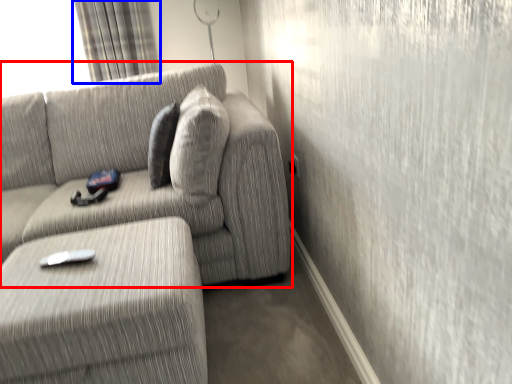
Question: Among these objects, which one is nearest to the camera, studio couch (highlighted by a red box) or curtain (highlighted by a blue box)?

Choices:
 (A) studio couch
 (B) curtain

Answer: (A)